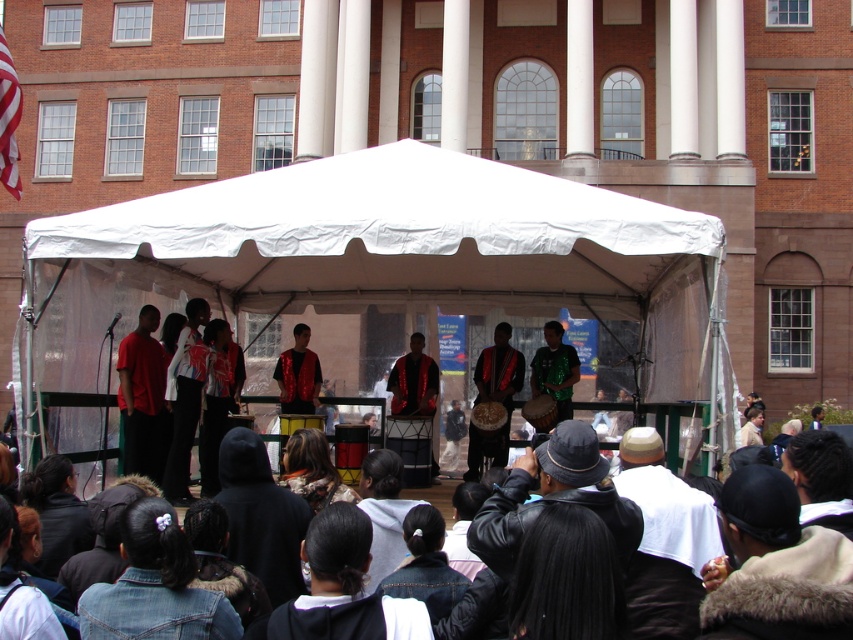
Question: Which point is farther from the camera taking this photo?

Choices:
 (A) (578, 440)
 (B) (142, 353)
 (C) (550, 328)

Answer: (C)

Question: Which of the following is the closest to the observer?

Choices:
 (A) shiny green sequined shirt at center
 (B) shiny red fabric at center

Answer: (B)

Question: Can you confirm if white fabric canopy at center is positioned to the left of shiny red fabric at center?

Choices:
 (A) yes
 (B) no

Answer: (A)

Question: Is matte red drum at center above shiny green sequined shirt at center?

Choices:
 (A) no
 (B) yes

Answer: (A)

Question: Estimate the real-world distances between objects in this image. Which object is farther from the white fabric canopy at center?

Choices:
 (A) shiny red fabric at center
 (B) matte red drum at center
 (C) shiny green sequined shirt at center

Answer: (B)

Question: Is white fabric canopy at center thinner than shiny green sequined shirt at center?

Choices:
 (A) no
 (B) yes

Answer: (A)